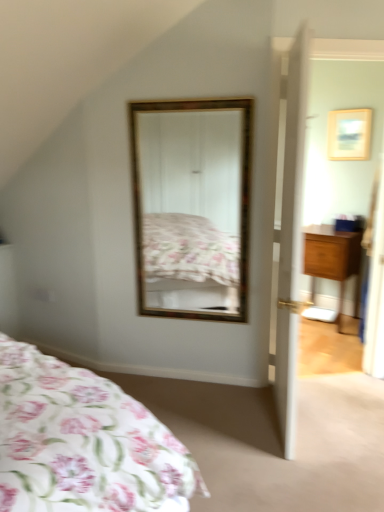
Image resolution: width=384 pixels, height=512 pixels. Find the location of `blank space to the left of white wooden door at right`. blank space to the left of white wooden door at right is located at coordinates (224, 419).